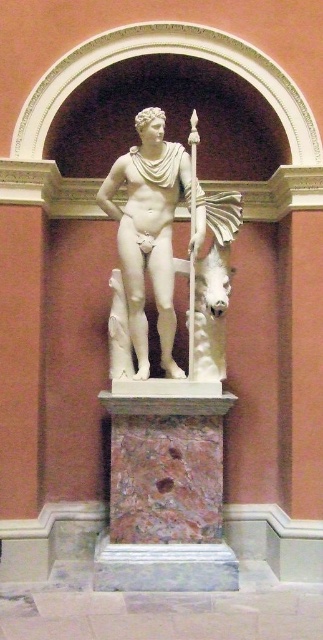
You are an art conservator assessing the stability of the statue. Given that the marble pedestal at center supports the white marble statue at center, which object should you inspect first to ensure the statue remains stable?

You should inspect the marble pedestal at center first because it is positioned under the white marble statue at center and provides the foundational support for its stability.